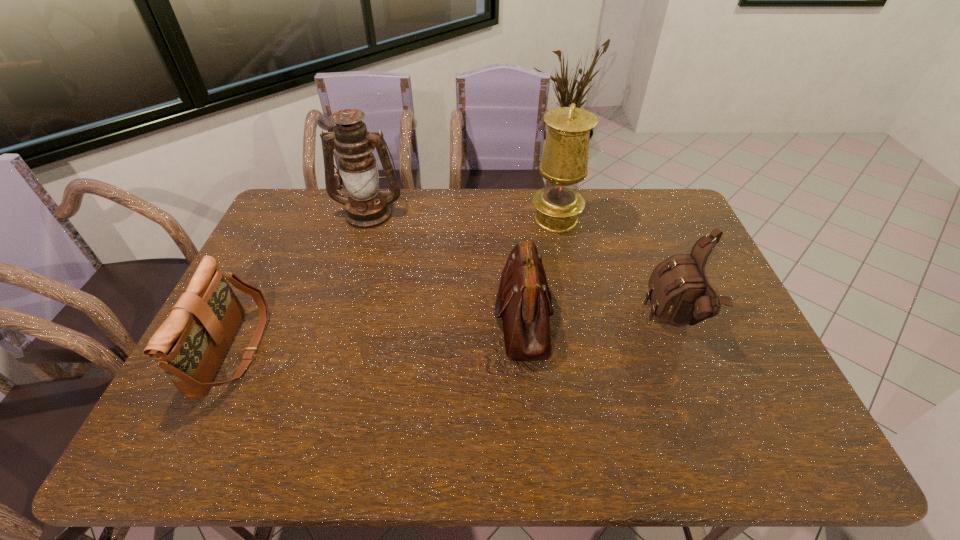
Identify which object is located as the second nearest to the second shoulder bag from right to left. Please provide its 2D coordinates. Your answer should be formatted as a tuple, i.e. [(x, y)], where the tuple contains the x and y coordinates of a point satisfying the conditions above.

[(680, 294)]

Where is `shoulder bag that stands as the closest to the right lantern`? The width and height of the screenshot is (960, 540). shoulder bag that stands as the closest to the right lantern is located at coordinates (524, 302).

Identify which shoulder bag is the nearest to the leftmost object. Please provide its 2D coordinates. Your answer should be formatted as a tuple, i.e. [(x, y)], where the tuple contains the x and y coordinates of a point satisfying the conditions above.

[(524, 302)]

I want to click on vacant region that satisfies the following two spatial constraints: 1. on the front side of the fourth object from right to left; 2. on the right side of the second shoulder bag from left to right, so click(x=339, y=316).